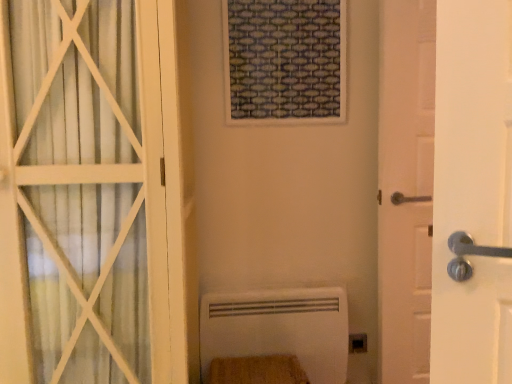
Question: Is black plastic electric outlet at lower right taller or shorter than wooden textured window frame at upper center?

Choices:
 (A) short
 (B) tall

Answer: (A)

Question: Relative to wooden textured window frame at upper center, is black plastic electric outlet at lower right in front or behind?

Choices:
 (A) behind
 (B) front

Answer: (A)

Question: Which is nearer to the white wooden door at right, which ranks as the 2th door in left-to-right order?

Choices:
 (A) wooden textured window frame at upper center
 (B) black plastic electric outlet at lower right
 (C) white matte radiator at lower center
 (D) white matte door at left, which is the 1th door from left to right

Answer: (A)

Question: Considering the real-world distances, which object is farthest from the white wooden door at right, the 1th door viewed from the right?

Choices:
 (A) black plastic electric outlet at lower right
 (B) white matte radiator at lower center
 (C) wooden textured window frame at upper center
 (D) white matte door at left, which is the 1th door from left to right

Answer: (D)